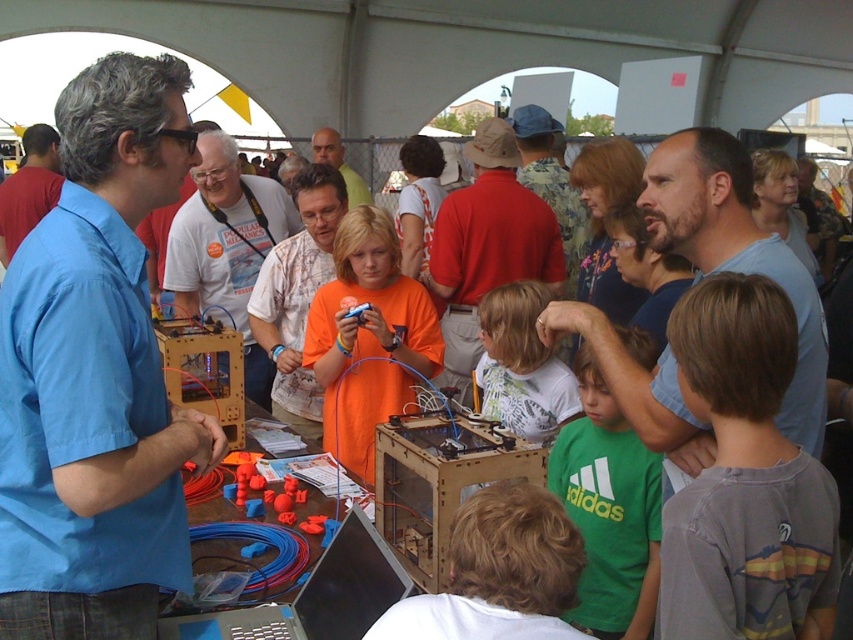
Question: Is brown cotton shirt at center-right below bearded blue shirt at center?

Choices:
 (A) no
 (B) yes

Answer: (B)

Question: Considering the real-world distances, which object is farthest from the white shirt at center?

Choices:
 (A) matte red shirt at center
 (B) brown cotton shirt at center-right

Answer: (B)

Question: Is orange matte shirt at center positioned at the back of matte red shirt at center?

Choices:
 (A) no
 (B) yes

Answer: (A)

Question: Does orange matte shirt at center have a lesser width compared to matte orange shirt at center?

Choices:
 (A) yes
 (B) no

Answer: (B)

Question: Estimate the real-world distances between objects in this image. Which object is closer to the matte blue shirt at left?

Choices:
 (A) matte red shirt at center
 (B) blue shirt at left
 (C) orange matte shirt at center

Answer: (A)

Question: Which of the following is the farthest from the observer?

Choices:
 (A) (270, 307)
 (B) (541, 416)
 (C) (799, 500)

Answer: (A)